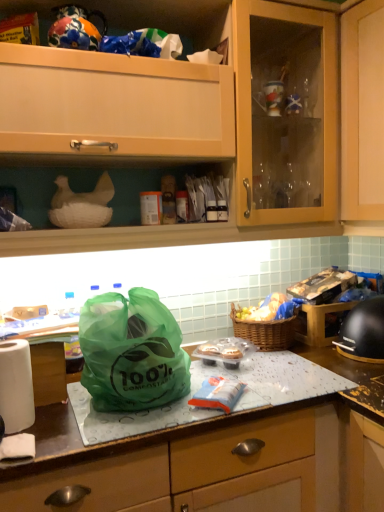
Question: From the image's perspective, is matte wood cabinet at upper center beneath white paper towel at left?

Choices:
 (A) no
 (B) yes

Answer: (A)

Question: From a real-world perspective, is matte wood cabinet at upper center physically below white paper towel at left?

Choices:
 (A) no
 (B) yes

Answer: (A)

Question: Is matte wood cabinet at upper center at the right side of white paper towel at left?

Choices:
 (A) no
 (B) yes

Answer: (B)

Question: Can you confirm if matte wood cabinet at upper center is taller than white paper towel at left?

Choices:
 (A) no
 (B) yes

Answer: (B)

Question: Is white paper towel at left at the back of matte wood cabinet at upper center?

Choices:
 (A) no
 (B) yes

Answer: (A)

Question: In the image, is woven brown picnic basket at center on the left side or the right side of white paper towel at left?

Choices:
 (A) right
 (B) left

Answer: (A)

Question: From the image's perspective, is woven brown picnic basket at center positioned above or below white paper towel at left?

Choices:
 (A) above
 (B) below

Answer: (A)

Question: Considering the positions of woven brown picnic basket at center and white paper towel at left in the image, is woven brown picnic basket at center wider or thinner than white paper towel at left?

Choices:
 (A) thin
 (B) wide

Answer: (B)

Question: Is woven brown picnic basket at center inside the boundaries of white paper towel at left, or outside?

Choices:
 (A) outside
 (B) inside

Answer: (A)

Question: In terms of height, does white paper towel at left look taller or shorter compared to woven brown picnic basket at center?

Choices:
 (A) tall
 (B) short

Answer: (A)

Question: Looking at their shapes, would you say white paper towel at left is wider or thinner than woven brown picnic basket at center?

Choices:
 (A) thin
 (B) wide

Answer: (A)

Question: Does point (13, 346) appear closer or farther from the camera than point (251, 326)?

Choices:
 (A) farther
 (B) closer

Answer: (B)

Question: Considering their positions, is white paper towel at left located in front of or behind woven brown picnic basket at center?

Choices:
 (A) behind
 (B) front

Answer: (B)

Question: From a real-world perspective, relative to yellowish matte bread at right, is matte wood cabinet at upper center vertically above or below?

Choices:
 (A) above
 (B) below

Answer: (A)

Question: In terms of width, does matte wood cabinet at upper center look wider or thinner when compared to yellowish matte bread at right?

Choices:
 (A) wide
 (B) thin

Answer: (A)